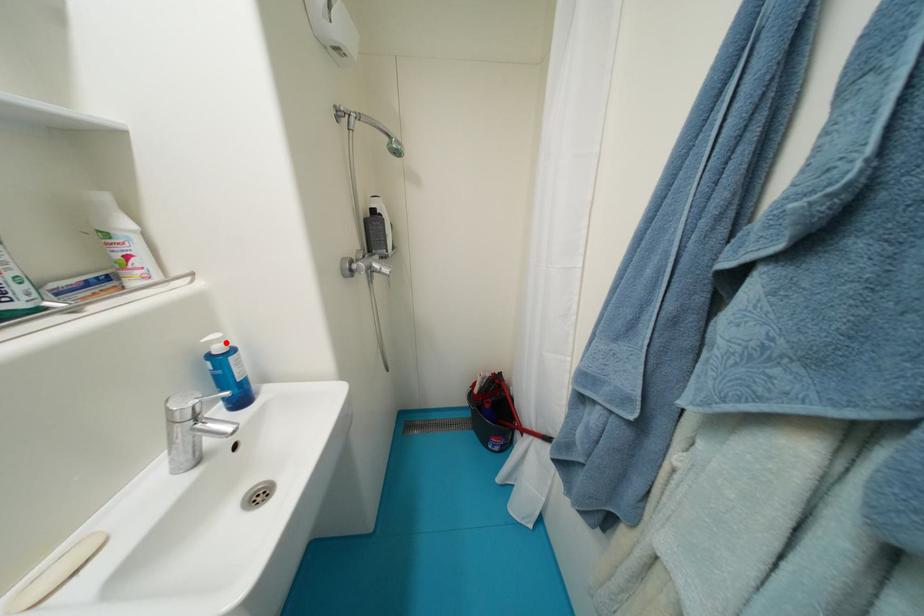
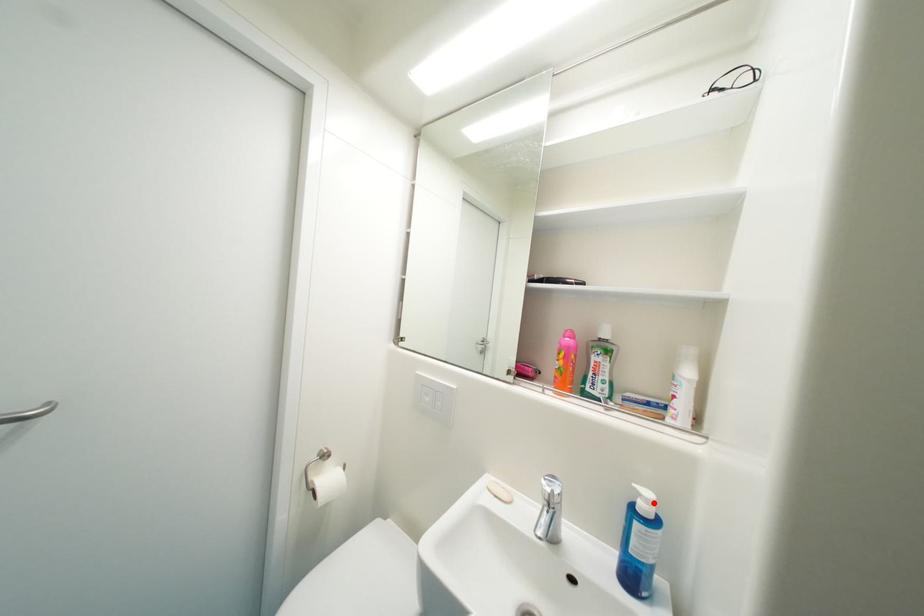
I am providing you with two images of the same scene from different viewpoints. A red point is marked on the first image and another point is marked on the second image. Is the marked point in image1 the same physical position as the marked point in image2?

Yes